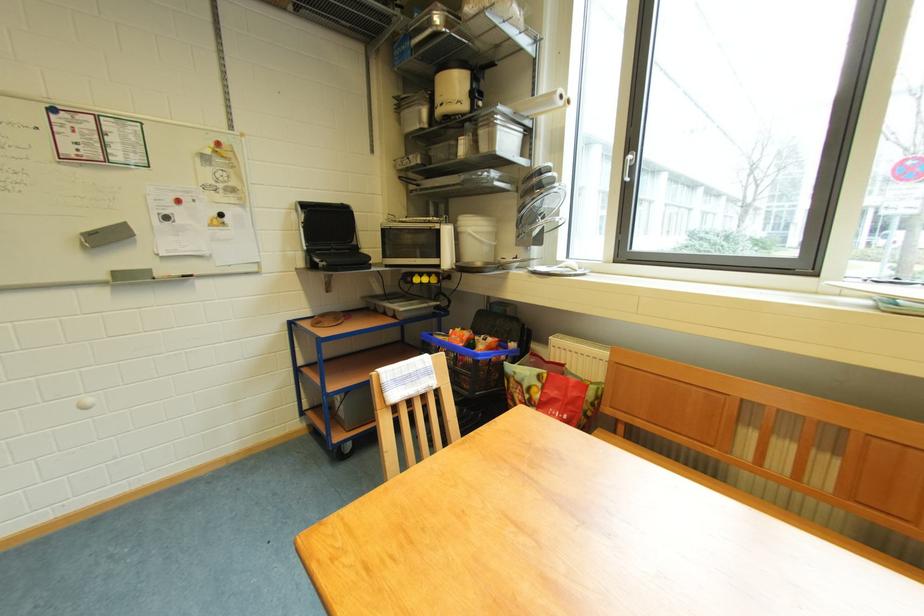
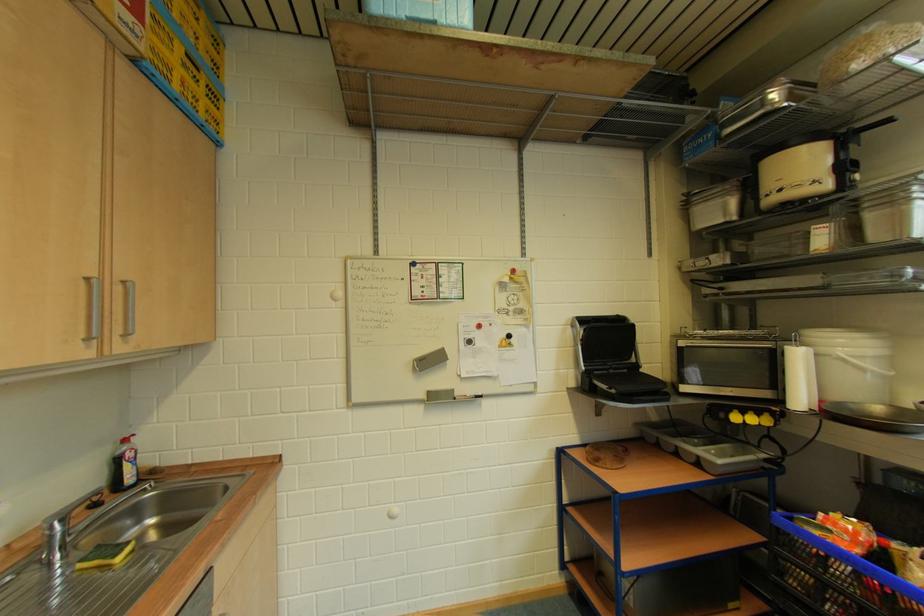
Question: The first image is from the beginning of the video and the second image is from the end. How did the camera likely rotate when shooting the video?

Choices:
 (A) Left
 (B) Right
 (C) Up
 (D) Down

Answer: (A)